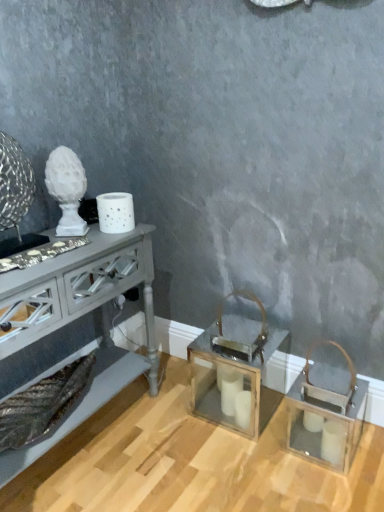
The height and width of the screenshot is (512, 384). I want to click on vacant region below clear glass lantern at center, the 2th table in the left-to-right sequence (from a real-world perspective), so click(223, 413).